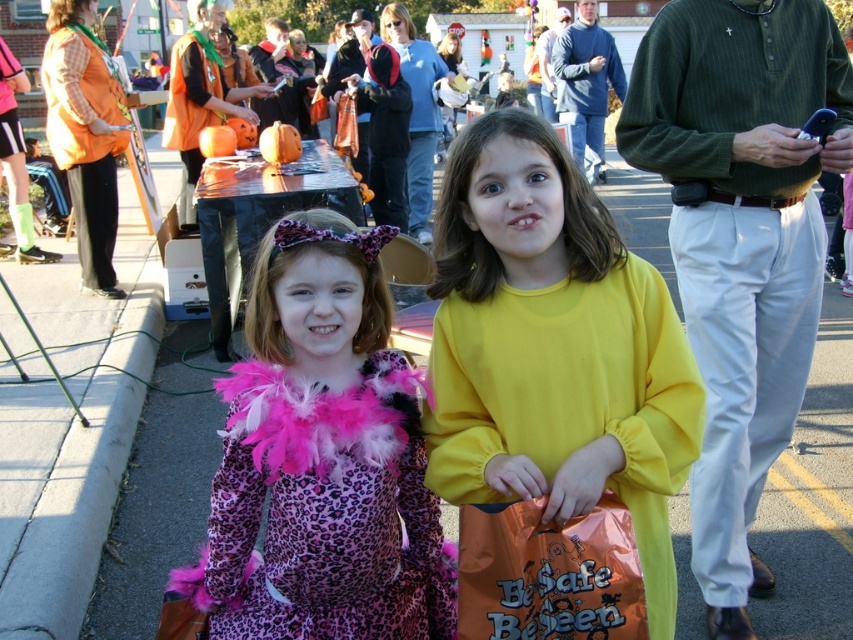
Question: Which point is farther to the camera?

Choices:
 (A) orange fabric vest at left
 (B) green knit sweater at upper right

Answer: (B)

Question: Estimate the real-world distances between objects in this image. Which object is farther from the green pinstripe sweater at upper right?

Choices:
 (A) yellow matte shirt at center
 (B) green textured sweater at upper right
 (C) green knit sweater at upper right
 (D) orange plastic bag at lower center

Answer: (B)

Question: Does orange plastic bag at lower center appear on the left side of green textured sweater at upper right?

Choices:
 (A) yes
 (B) no

Answer: (A)

Question: Based on their relative distances, which object is farther from the yellow matte shirt at center?

Choices:
 (A) green textured sweater at upper right
 (B) orange plastic bag at lower center

Answer: (A)

Question: Can you confirm if yellow matte shirt at center is smaller than orange plastic bag at lower center?

Choices:
 (A) no
 (B) yes

Answer: (A)

Question: Does green pinstripe sweater at upper right appear on the left side of green textured sweater at upper right?

Choices:
 (A) no
 (B) yes

Answer: (B)